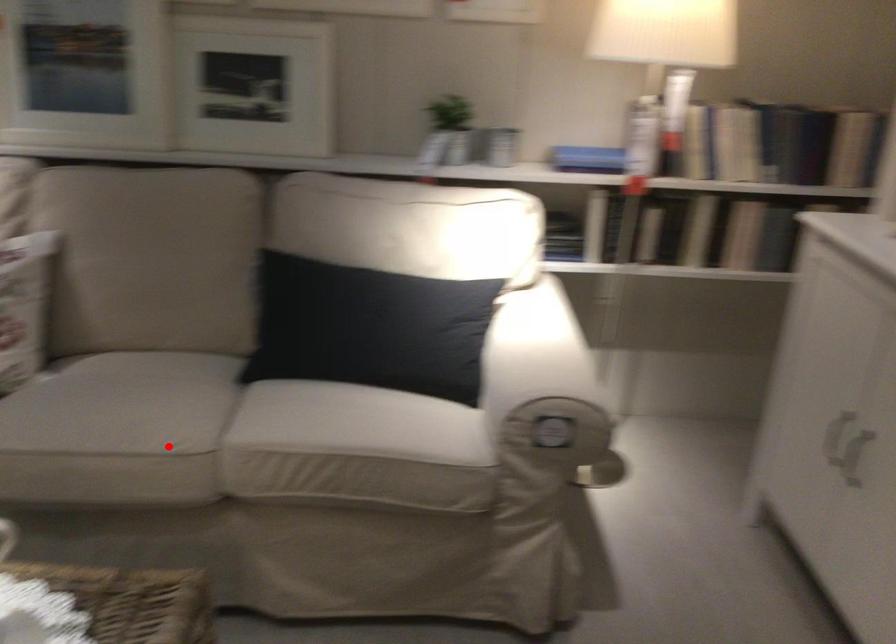
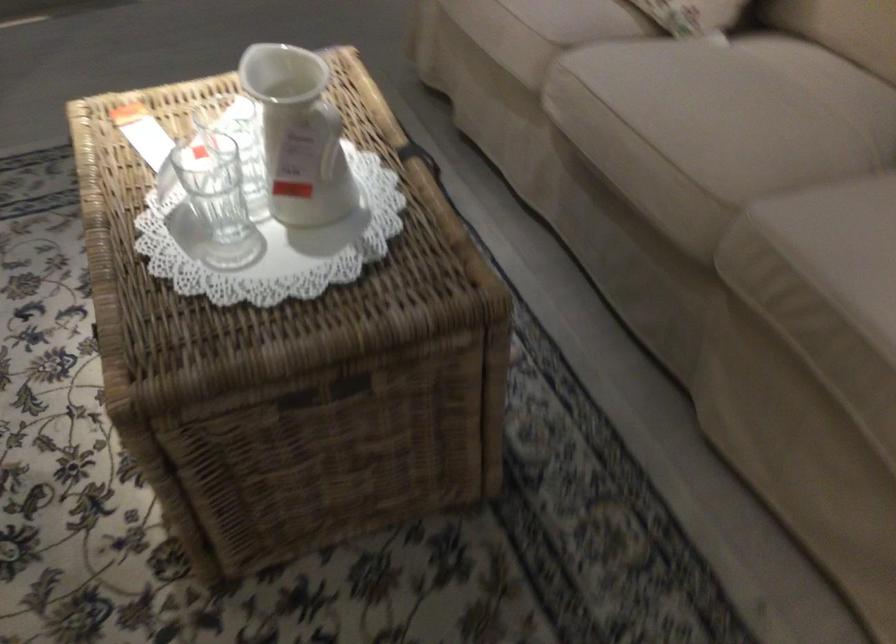
Question: I am providing you with two images of the same scene from different viewpoints. In image1, a red point is highlighted. Considering the same 3D point in image2, which of the following is correct?

Choices:
 (A) It is closer
 (B) It is farther

Answer: (A)